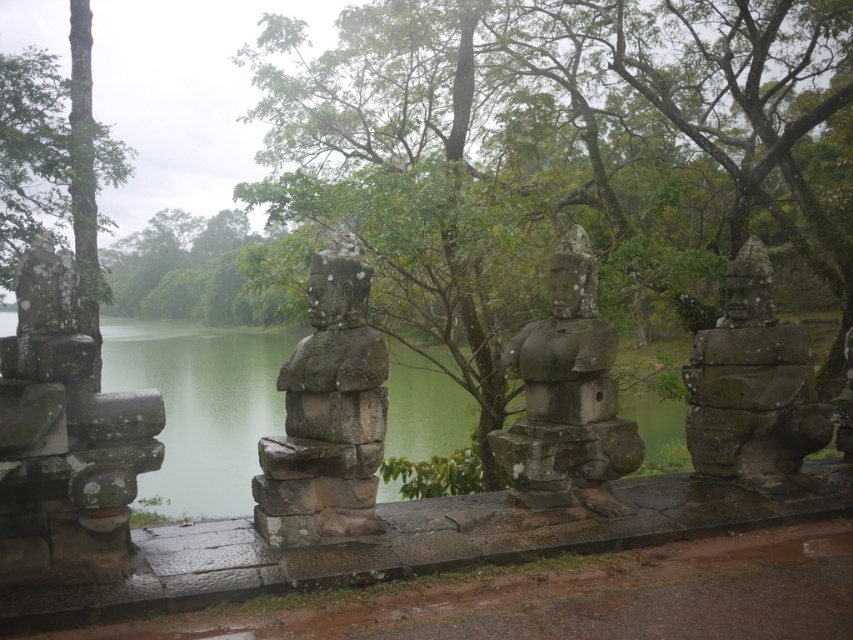
Question: Does stone statue at center appear over gray stone statue at center?

Choices:
 (A) no
 (B) yes

Answer: (A)

Question: Does green leafy tree at center have a lesser width compared to green rough bark tree at upper left?

Choices:
 (A) yes
 (B) no

Answer: (A)

Question: Which of the following is the farthest from the observer?

Choices:
 (A) green rough bark tree at upper left
 (B) gray stone statue at center
 (C) rusty stone statue at left

Answer: (A)

Question: Which point appears farthest from the camera in this image?

Choices:
 (A) (347, 328)
 (B) (509, 284)
 (C) (755, 285)

Answer: (B)

Question: Is gray stone statue at right behind green rough bark tree at upper left?

Choices:
 (A) yes
 (B) no

Answer: (B)

Question: Estimate the real-world distances between objects in this image. Which object is closer to the green leafy tree at center?

Choices:
 (A) stone statue at center
 (B) gray stone statue at right

Answer: (B)